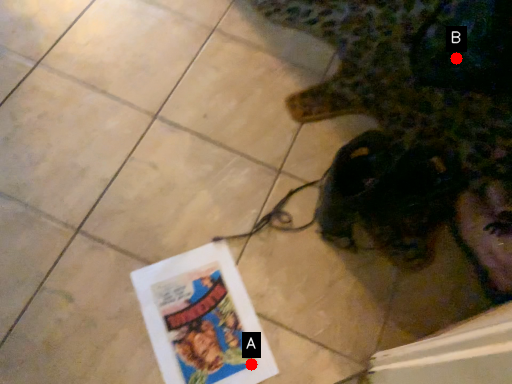
Question: Two points are circled on the image, labeled by A and B beside each circle. Which point appears farthest from the camera in this image?

Choices:
 (A) A is further
 (B) B is further

Answer: (B)